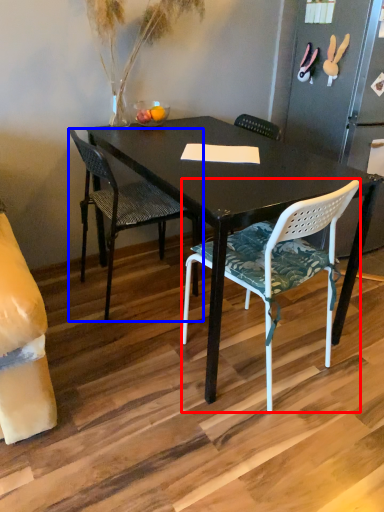
Question: Which object is closer to the camera taking this photo, chair (highlighted by a red box) or chair (highlighted by a blue box)?

Choices:
 (A) chair
 (B) chair

Answer: (A)